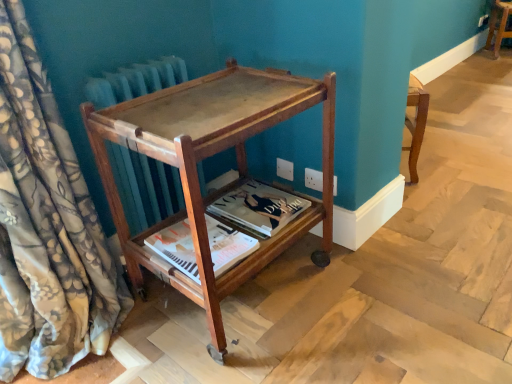
Describe the element at coordinates (176, 248) in the screenshot. I see `matte paper magazine at center, which is the 2th magazine from back to front` at that location.

Describe the element at coordinates (259, 207) in the screenshot. I see `matte paper magazine at center, positioned as the 2th magazine in front-to-back order` at that location.

This screenshot has width=512, height=384. Find the location of `mahogany wood side table at center, the 1th furniture from the front`. mahogany wood side table at center, the 1th furniture from the front is located at coordinates (210, 156).

How different are the orientations of matte paper magazine at center, positioned as the 2th magazine in front-to-back order, and floral silk curtain at left in degrees?

The angular difference between matte paper magazine at center, positioned as the 2th magazine in front-to-back order, and floral silk curtain at left is 0.539 degrees.

From the image's perspective, who appears lower, matte paper magazine at center, which is the 1th magazine from back to front, or floral silk curtain at left?

matte paper magazine at center, which is the 1th magazine from back to front, appears lower in the image.

Which is less distant, (x=269, y=213) or (x=22, y=347)?

Point (x=269, y=213) is positioned farther from the camera compared to point (x=22, y=347).

Find the location of a particular element. curtain above the matte paper magazine at center, which is the 1th magazine from back to front (from the image's perspective) is located at coordinates (47, 226).

Is wooden stool at center, arranged as the first furniture when viewed from the back, not near floral silk curtain at left?

Yes, wooden stool at center, arranged as the first furniture when viewed from the back, and floral silk curtain at left are quite far apart.

From the picture: Could you tell me if wooden stool at center, arranged as the first furniture when viewed from the back, is turned towards floral silk curtain at left?

No, wooden stool at center, arranged as the first furniture when viewed from the back, does not turn towards floral silk curtain at left.

In the scene shown: From the image's perspective, is wooden stool at center, the 2th furniture from the front, beneath floral silk curtain at left?

No, from the image's perspective, wooden stool at center, the 2th furniture from the front, is not below floral silk curtain at left.

In the scene shown: Considering the positions of objects wooden stool at center, the 2th furniture from the front, and floral silk curtain at left in the image provided, who is more to the right, wooden stool at center, the 2th furniture from the front, or floral silk curtain at left?

From the viewer's perspective, wooden stool at center, the 2th furniture from the front, appears more on the right side.

Could you tell me if floral silk curtain at left is turned towards mahogany wood side table at center, the 2th furniture in the right-to-left sequence?

No, floral silk curtain at left is not aimed at mahogany wood side table at center, the 2th furniture in the right-to-left sequence.

Between point (0, 262) and point (285, 230), which one is positioned in front?

The point (0, 262) is closer to the camera.

What's the angular difference between floral silk curtain at left and mahogany wood side table at center, the 1th furniture from the front,'s facing directions?

The angular difference between floral silk curtain at left and mahogany wood side table at center, the 1th furniture from the front, is 0.653 degrees.

Considering the relative sizes of matte paper magazine at center, which is counted as the 1th magazine, starting from the front, and wooden stool at center, the 2th furniture from the left, in the image provided, is matte paper magazine at center, which is counted as the 1th magazine, starting from the front, smaller than wooden stool at center, the 2th furniture from the left,?

Correct, matte paper magazine at center, which is counted as the 1th magazine, starting from the front, occupies less space than wooden stool at center, the 2th furniture from the left.

From the picture: Is matte paper magazine at center, which is counted as the 1th magazine, starting from the front, wider or thinner than wooden stool at center, arranged as the first furniture when viewed from the back?

Clearly, matte paper magazine at center, which is counted as the 1th magazine, starting from the front, has less width compared to wooden stool at center, arranged as the first furniture when viewed from the back.

Which object is positioned more to the right, matte paper magazine at center, which is the 2th magazine from back to front, or wooden stool at center, placed as the first furniture when sorted from top to bottom?

wooden stool at center, placed as the first furniture when sorted from top to bottom.

This screenshot has height=384, width=512. I want to click on furniture behind the matte paper magazine at center, which is counted as the 1th magazine, starting from the front, so click(499, 25).

Is matte paper magazine at center, which is counted as the 1th magazine, starting from the front, surrounded by mahogany wood side table at center, arranged as the 2th furniture when viewed from the top?

That's correct, matte paper magazine at center, which is counted as the 1th magazine, starting from the front, is inside mahogany wood side table at center, arranged as the 2th furniture when viewed from the top.

From a real-world perspective, which is physically above, mahogany wood side table at center, the 2th furniture in the right-to-left sequence, or matte paper magazine at center, which is the 2th magazine from back to front?

mahogany wood side table at center, the 2th furniture in the right-to-left sequence.

From a real-world perspective, starting from the mahogany wood side table at center, the 1th furniture from the front, which magazine is the 1st one below it? Please provide its 2D coordinates.

[(176, 248)]

Does mahogany wood side table at center, which appears as the 1th furniture when viewed from the left, have a lesser height compared to matte paper magazine at center, which is the 2th magazine from back to front?

No, mahogany wood side table at center, which appears as the 1th furniture when viewed from the left, is not shorter than matte paper magazine at center, which is the 2th magazine from back to front.

From the image's perspective, is wooden stool at center, the 2th furniture from the left, positioned above or below mahogany wood side table at center, the 2th furniture in the right-to-left sequence?

Based on their image positions, wooden stool at center, the 2th furniture from the left, is located above mahogany wood side table at center, the 2th furniture in the right-to-left sequence.

Considering the positions of objects wooden stool at center, which ranks as the first furniture in right-to-left order, and mahogany wood side table at center, arranged as the 2th furniture when viewed from the top, in the image provided, who is behind, wooden stool at center, which ranks as the first furniture in right-to-left order, or mahogany wood side table at center, arranged as the 2th furniture when viewed from the top,?

wooden stool at center, which ranks as the first furniture in right-to-left order, is further from the camera.

Could you tell me if wooden stool at center, placed as the first furniture when sorted from top to bottom, is facing mahogany wood side table at center, which appears as the 1th furniture when viewed from the left?

No.

Can you confirm if matte paper magazine at center, which is the 2th magazine from back to front, is bigger than mahogany wood side table at center, which appears as the 1th furniture when viewed from the left?

No.

Considering the points (160, 242) and (224, 119), which point is in front, point (160, 242) or point (224, 119)?

The point (224, 119) is more forward.

Is matte paper magazine at center, which is counted as the 1th magazine, starting from the front, turned away from mahogany wood side table at center, the 1th furniture from the front?

Yes, matte paper magazine at center, which is counted as the 1th magazine, starting from the front, is positioned with its back facing mahogany wood side table at center, the 1th furniture from the front.

In the image, is matte paper magazine at center, which is counted as the 1th magazine, starting from the front, positioned in front of or behind mahogany wood side table at center, the 2th furniture positioned from the back?

Visually, matte paper magazine at center, which is counted as the 1th magazine, starting from the front, is located behind mahogany wood side table at center, the 2th furniture positioned from the back.

The width and height of the screenshot is (512, 384). There is a floral silk curtain at left. What are the coordinates of `the 2nd magazine below it (from a real-world perspective)` in the screenshot? It's located at (259, 207).

The image size is (512, 384). In the image, there is a wooden stool at center, the 2th furniture from the left. Find the location of `curtain below it (from the image's perspective)`. curtain below it (from the image's perspective) is located at coordinates (47, 226).

Based on their spatial positions, is wooden stool at center, placed as the first furniture when sorted from top to bottom, or matte paper magazine at center, which is the 2th magazine from back to front, further from floral silk curtain at left?

wooden stool at center, placed as the first furniture when sorted from top to bottom.

Which object lies nearer to the anchor point matte paper magazine at center, which is counted as the 1th magazine, starting from the front, matte paper magazine at center, which is the 1th magazine from back to front, or wooden stool at center, placed as the first furniture when sorted from top to bottom?

matte paper magazine at center, which is the 1th magazine from back to front, lies closer to matte paper magazine at center, which is counted as the 1th magazine, starting from the front, than the other object.

When comparing their distances from wooden stool at center, marked as the second furniture in a bottom-to-top arrangement, does matte paper magazine at center, which is the 1th magazine from back to front, or matte paper magazine at center, which is counted as the 1th magazine, starting from the front, seem closer?

The object closer to wooden stool at center, marked as the second furniture in a bottom-to-top arrangement, is matte paper magazine at center, which is the 1th magazine from back to front.

Based on their spatial positions, is floral silk curtain at left or wooden stool at center, placed as the first furniture when sorted from top to bottom, closer to matte paper magazine at center, which is the 1th magazine from back to front?

Among the two, floral silk curtain at left is located nearer to matte paper magazine at center, which is the 1th magazine from back to front.

Looking at the image, which one is located further to wooden stool at center, which ranks as the first furniture in right-to-left order, matte paper magazine at center, which is counted as the 1th magazine, starting from the front, or mahogany wood side table at center, which appears as the first furniture when ordered from the bottom?

Among the two, matte paper magazine at center, which is counted as the 1th magazine, starting from the front, is located further to wooden stool at center, which ranks as the first furniture in right-to-left order.

When comparing their distances from mahogany wood side table at center, which appears as the 1th furniture when viewed from the left, does floral silk curtain at left or matte paper magazine at center, which is counted as the 1th magazine, starting from the front, seem closer?

matte paper magazine at center, which is counted as the 1th magazine, starting from the front, is closer to mahogany wood side table at center, which appears as the 1th furniture when viewed from the left.

Estimate the real-world distances between objects in this image. Which object is closer to matte paper magazine at center, positioned as the 2th magazine in front-to-back order, mahogany wood side table at center, which appears as the 1th furniture when viewed from the left, or matte paper magazine at center, which is the 2th magazine from back to front?

The object closer to matte paper magazine at center, positioned as the 2th magazine in front-to-back order, is matte paper magazine at center, which is the 2th magazine from back to front.

When comparing their distances from floral silk curtain at left, does matte paper magazine at center, which is the 1th magazine from back to front, or mahogany wood side table at center, arranged as the 2th furniture when viewed from the top, seem further?

matte paper magazine at center, which is the 1th magazine from back to front, lies further to floral silk curtain at left than the other object.

The height and width of the screenshot is (384, 512). I want to click on magazine positioned between mahogany wood side table at center, arranged as the 2th furniture when viewed from the top, and matte paper magazine at center, positioned as the 2th magazine in front-to-back order, from near to far, so click(176, 248).

Find the location of a particular element. This screenshot has width=512, height=384. furniture positioned between floral silk curtain at left and matte paper magazine at center, which is the 1th magazine from back to front, from near to far is located at coordinates (210, 156).

Where is `magazine between matte paper magazine at center, which is counted as the 1th magazine, starting from the front, and wooden stool at center, the 2th furniture from the left, in the horizontal direction`? Image resolution: width=512 pixels, height=384 pixels. magazine between matte paper magazine at center, which is counted as the 1th magazine, starting from the front, and wooden stool at center, the 2th furniture from the left, in the horizontal direction is located at coordinates (259, 207).

Where is `furniture between floral silk curtain at left and wooden stool at center, placed as the first furniture when sorted from top to bottom, in the front-back direction`? Image resolution: width=512 pixels, height=384 pixels. furniture between floral silk curtain at left and wooden stool at center, placed as the first furniture when sorted from top to bottom, in the front-back direction is located at coordinates (210, 156).